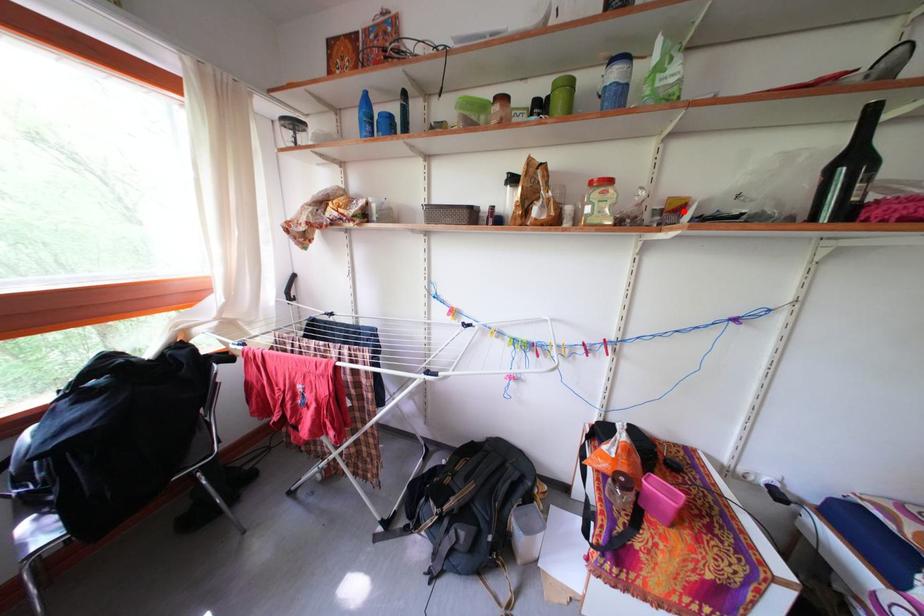
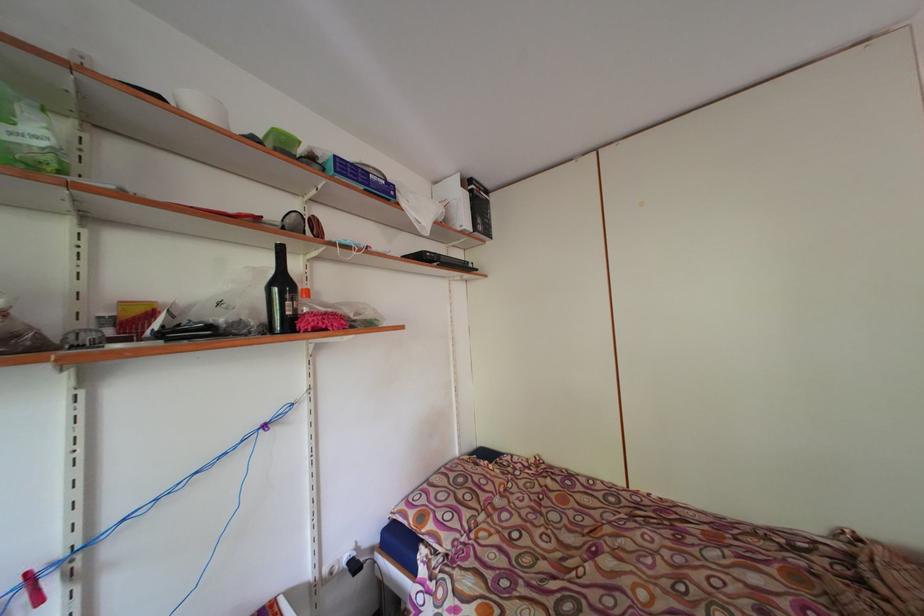
Locate, in the second image, the point that corresponds to the highlighted location in the first image.

(144, 317)